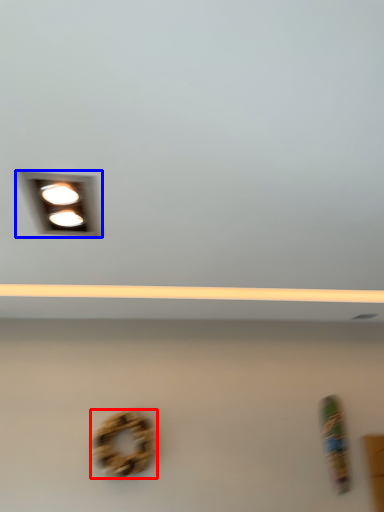
Question: Which of the following is the closest to the observer, bagel (highlighted by a red box) or lamp (highlighted by a blue box)?

Choices:
 (A) bagel
 (B) lamp

Answer: (B)